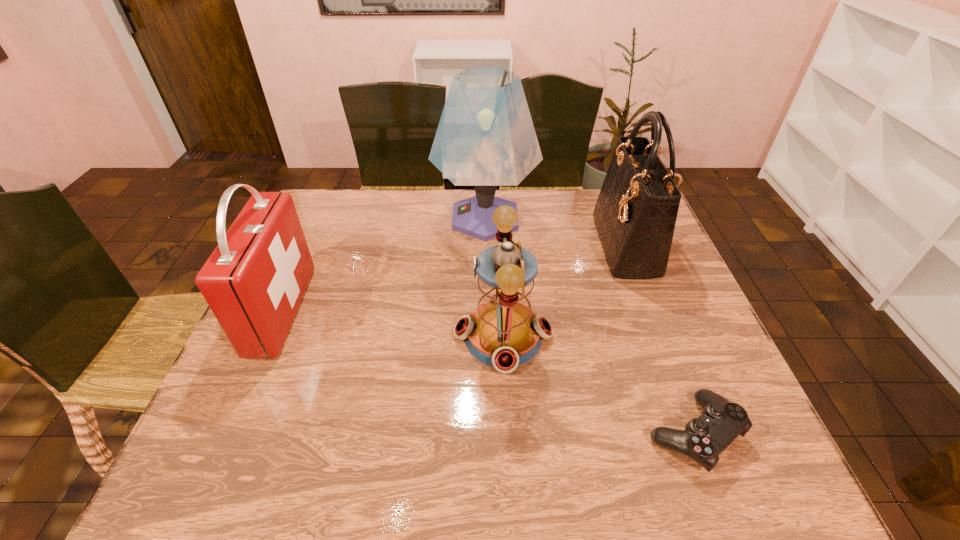
Locate an element on the screen. object situated at the left edge is located at coordinates (254, 281).

Image resolution: width=960 pixels, height=540 pixels. Identify the location of handbag that is at the right edge. (635, 214).

Locate an element on the screen. control present at the right edge is located at coordinates (704, 438).

I want to click on object that is at the far right corner, so click(635, 214).

This screenshot has width=960, height=540. I want to click on object that is at the near right corner, so click(x=704, y=438).

Image resolution: width=960 pixels, height=540 pixels. Identify the location of vacant space at the far edge. (501, 191).

Find the location of a particular element. Image resolution: width=960 pixels, height=540 pixels. free space at the near edge of the desktop is located at coordinates (494, 445).

Locate an element on the screen. free region at the left edge of the desktop is located at coordinates (305, 316).

Identify the location of free location at the right edge. The width and height of the screenshot is (960, 540). (647, 291).

Where is `vacant space at the far left corner of the desktop`? The width and height of the screenshot is (960, 540). vacant space at the far left corner of the desktop is located at coordinates (357, 197).